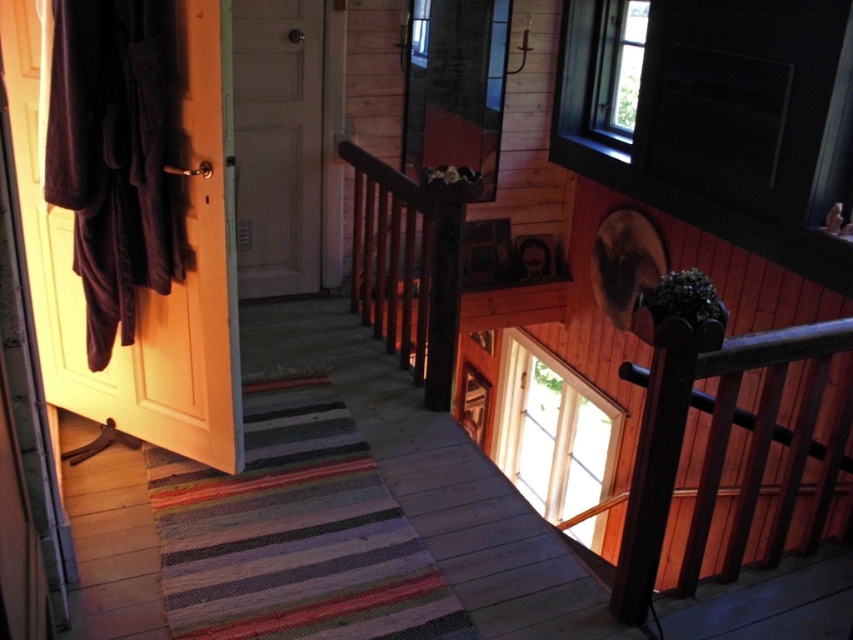
You are a painter who needs to hang a large painting that requires a sturdy support. You have two options in the scene, the wooden balustrade at upper right and the white wood door at center. Which one is taller and thus more suitable for supporting the heavy painting?

The white wood door at center is taller than the wooden balustrade at upper right, so it would be more suitable for supporting the heavy painting.

You are standing at the entrance of the cabin and see the brown velvety coat at left. If you want to hang it on the coat rack located at point 0.5, 0.2, will it be within reach? Please consider the coordinates provided.

The brown velvety coat at left is located at point (144,289), which is close to the coat rack at (170,320). The distance between them is minimal, so it would be within reach to hang it there.